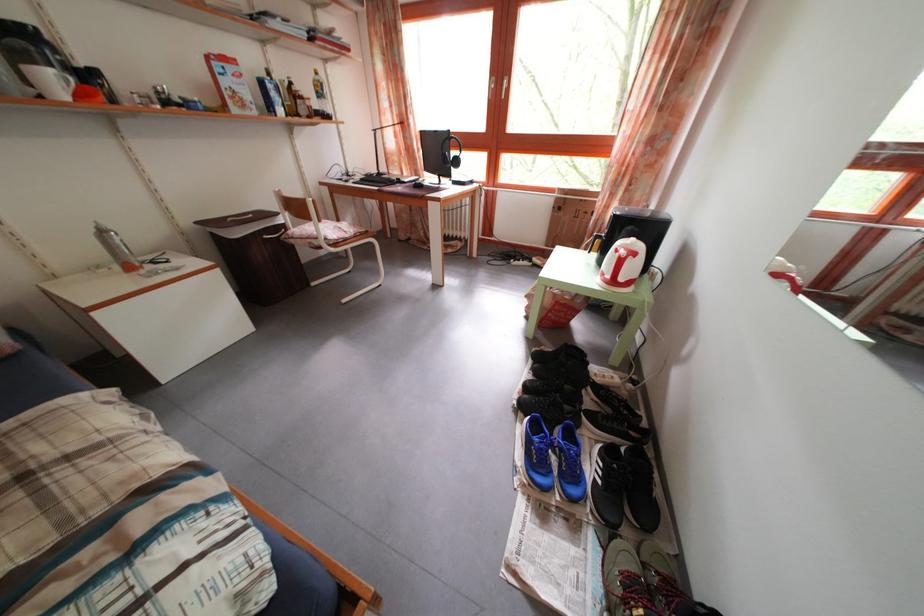
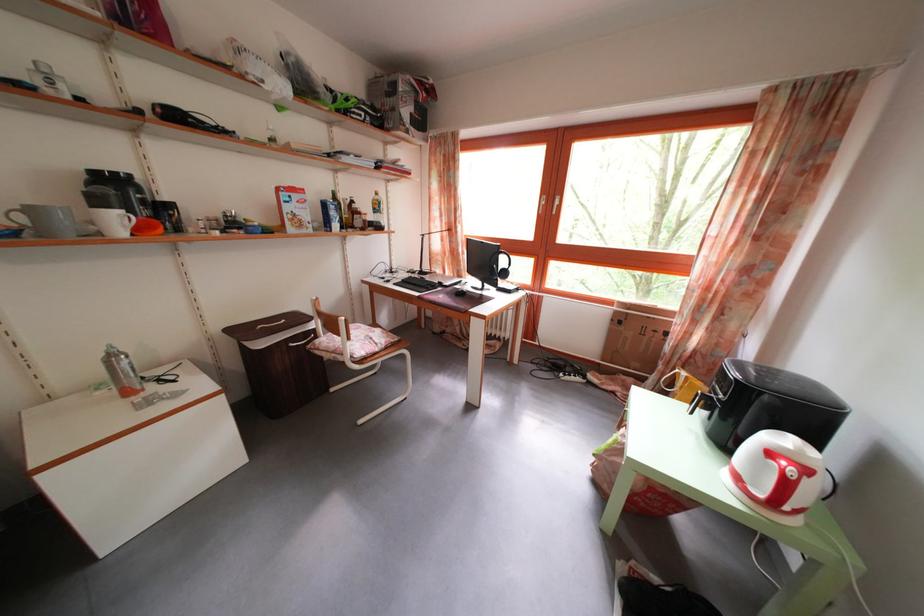
The point at (185,275) is marked in the first image. Where is the corresponding point in the second image?

(185, 402)